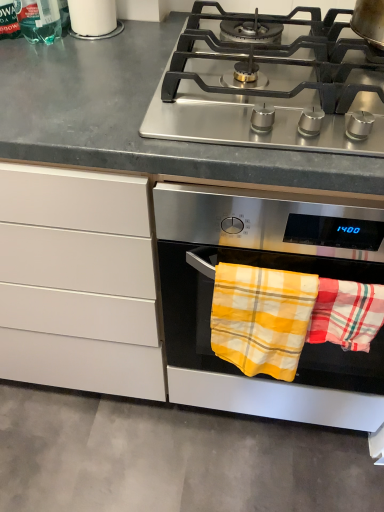
This screenshot has height=512, width=384. I want to click on vacant point to the right of white glossy cup at upper left, so click(x=152, y=28).